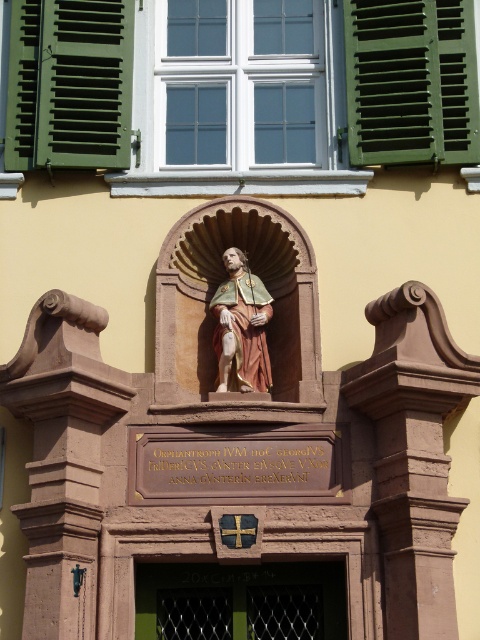
You are an architect inspecting the building facade. You notice the green painted wood at upper right and the polychrome wood statue at center. Which of these two elements has a greater visual prominence due to its size?

The green painted wood at upper right has a larger size compared to the polychrome wood statue at center, so it has greater visual prominence due to its size.

You are an architect analyzing the building facade. The green matte shutters at upper left are part of the design. Where exactly are they located in terms of coordinates?

The green matte shutters at upper left are located at coordinates point (70, 83).